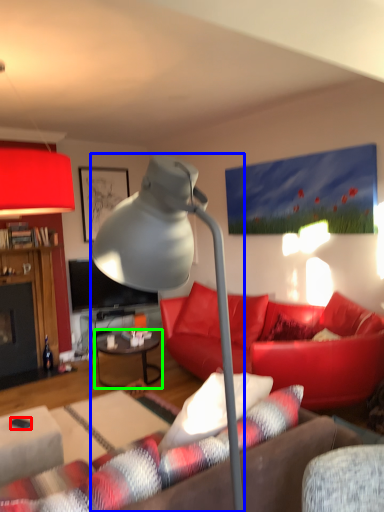
Question: Which object is positioned closest to corded phone (highlighted by a red box)? Select from lamp (highlighted by a blue box) and table (highlighted by a green box).

Choices:
 (A) lamp
 (B) table

Answer: (A)